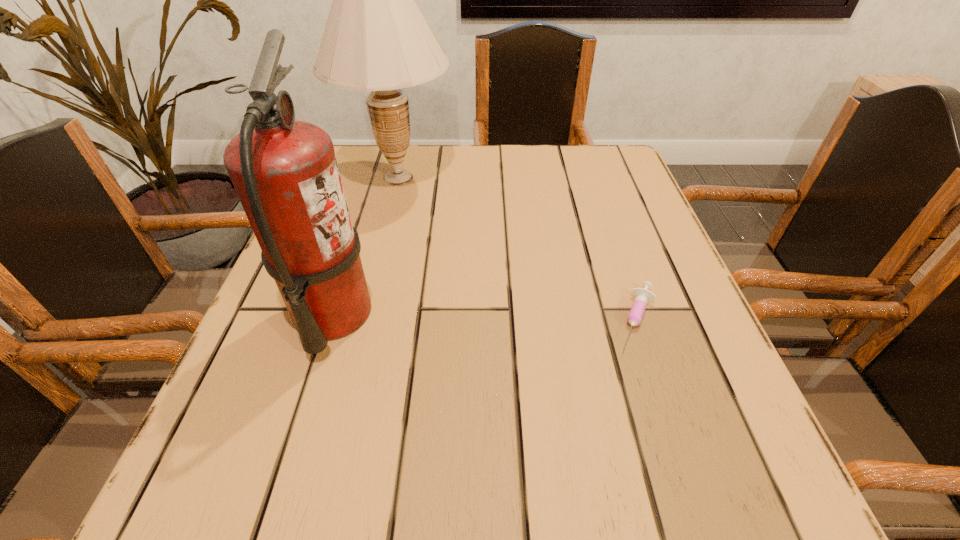
Identify the location of the farthest object. (376, 39).

I want to click on fire extinguisher, so click(285, 172).

Locate an element on the screen. the shortest object is located at coordinates (642, 296).

The height and width of the screenshot is (540, 960). What are the coordinates of `the rightmost object` in the screenshot? It's located at (642, 296).

Identify the location of vacant space located on the right of the farthest object. Image resolution: width=960 pixels, height=540 pixels. (617, 178).

Locate an element on the screen. This screenshot has height=540, width=960. vacant space located toward the nozzle of the fire extinguisher is located at coordinates (486, 314).

The image size is (960, 540). I want to click on free spot located 0.060m on the front of the syringe, so click(660, 388).

This screenshot has height=540, width=960. In order to click on object that is positioned at the far edge in this screenshot , I will do `click(376, 39)`.

I want to click on lampshade located in the left edge section of the desktop, so click(x=376, y=39).

At what (x,y) coordinates should I click in order to perform the action: click on fire extinguisher that is at the left edge. Please return your answer as a coordinate pair (x, y). Looking at the image, I should click on (285, 172).